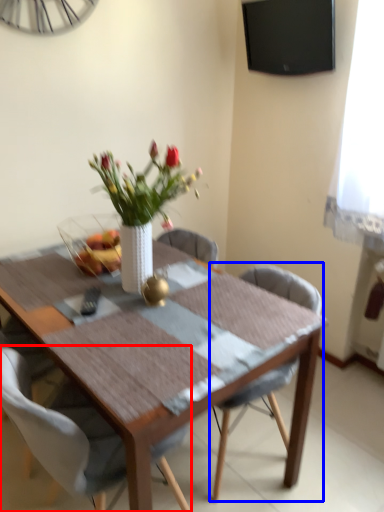
Question: Which object appears farthest to the camera in this image, chair (highlighted by a red box) or chair (highlighted by a blue box)?

Choices:
 (A) chair
 (B) chair

Answer: (B)